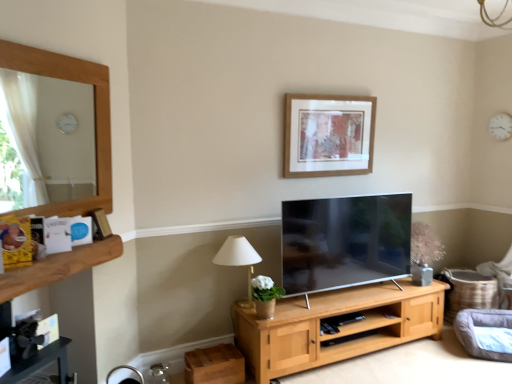
Question: Is wooden picture frame at upper center taller than brushed metal fireplace at lower left?

Choices:
 (A) yes
 (B) no

Answer: (B)

Question: From the image's perspective, would you say wooden picture frame at upper center is shown under brushed metal fireplace at lower left?

Choices:
 (A) yes
 (B) no

Answer: (B)

Question: Is wooden picture frame at upper center aimed at brushed metal fireplace at lower left?

Choices:
 (A) yes
 (B) no

Answer: (B)

Question: Considering the relative sizes of wooden picture frame at upper center and brushed metal fireplace at lower left in the image provided, is wooden picture frame at upper center thinner than brushed metal fireplace at lower left?

Choices:
 (A) no
 (B) yes

Answer: (B)

Question: Is wooden picture frame at upper center facing away from brushed metal fireplace at lower left?

Choices:
 (A) no
 (B) yes

Answer: (A)

Question: Is gray fabric swivel chair at lower right spatially inside brushed metal fireplace at lower left, or outside of it?

Choices:
 (A) inside
 (B) outside

Answer: (B)

Question: Is gray fabric swivel chair at lower right wider or thinner than brushed metal fireplace at lower left?

Choices:
 (A) thin
 (B) wide

Answer: (B)

Question: Considering the positions of point (457, 326) and point (97, 251), is point (457, 326) closer or farther from the camera than point (97, 251)?

Choices:
 (A) closer
 (B) farther

Answer: (B)

Question: Based on their positions, is gray fabric swivel chair at lower right located to the left or right of brushed metal fireplace at lower left?

Choices:
 (A) left
 (B) right

Answer: (B)

Question: From the image's perspective, relative to white fabric lampshade at lower center, is white plastic clock at upper right above or below?

Choices:
 (A) below
 (B) above

Answer: (B)

Question: Considering the positions of white plastic clock at upper right and white fabric lampshade at lower center in the image, is white plastic clock at upper right wider or thinner than white fabric lampshade at lower center?

Choices:
 (A) wide
 (B) thin

Answer: (B)

Question: Considering their positions, is white plastic clock at upper right located in front of or behind white fabric lampshade at lower center?

Choices:
 (A) front
 (B) behind

Answer: (B)

Question: From a real-world perspective, is white plastic clock at upper right physically located above or below white fabric lampshade at lower center?

Choices:
 (A) above
 (B) below

Answer: (A)

Question: Considering their positions, is brushed metal fireplace at lower left located in front of or behind gray fabric swivel chair at lower right?

Choices:
 (A) front
 (B) behind

Answer: (A)

Question: From a real-world perspective, relative to gray fabric swivel chair at lower right, is brushed metal fireplace at lower left vertically above or below?

Choices:
 (A) below
 (B) above

Answer: (B)